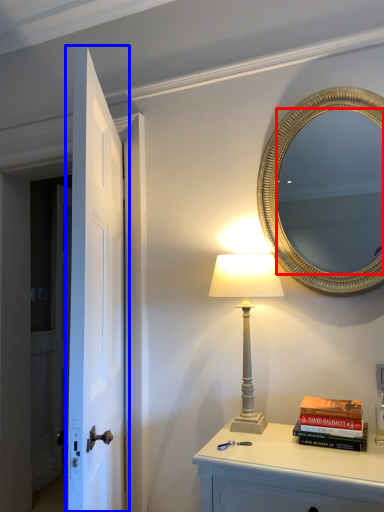
Question: Which of the following is the closest to the observer, mirror (highlighted by a red box) or door (highlighted by a blue box)?

Choices:
 (A) mirror
 (B) door

Answer: (B)